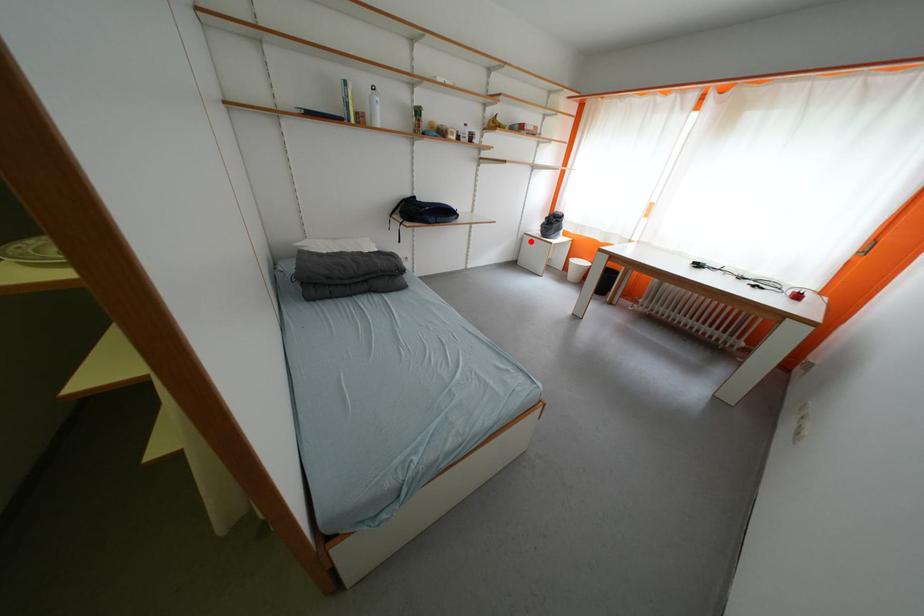
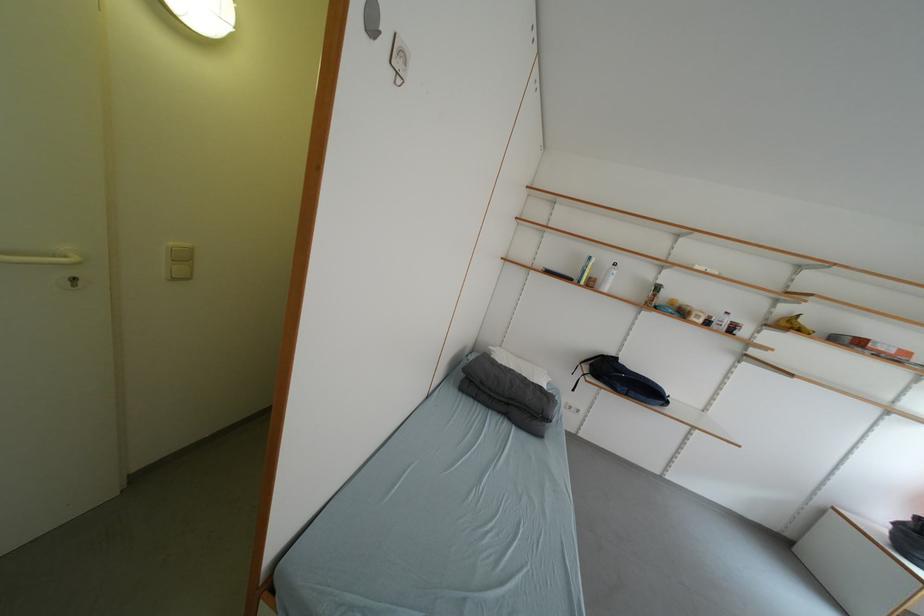
Find the pixel in the second image that matches the highlighted location in the first image.

(832, 515)